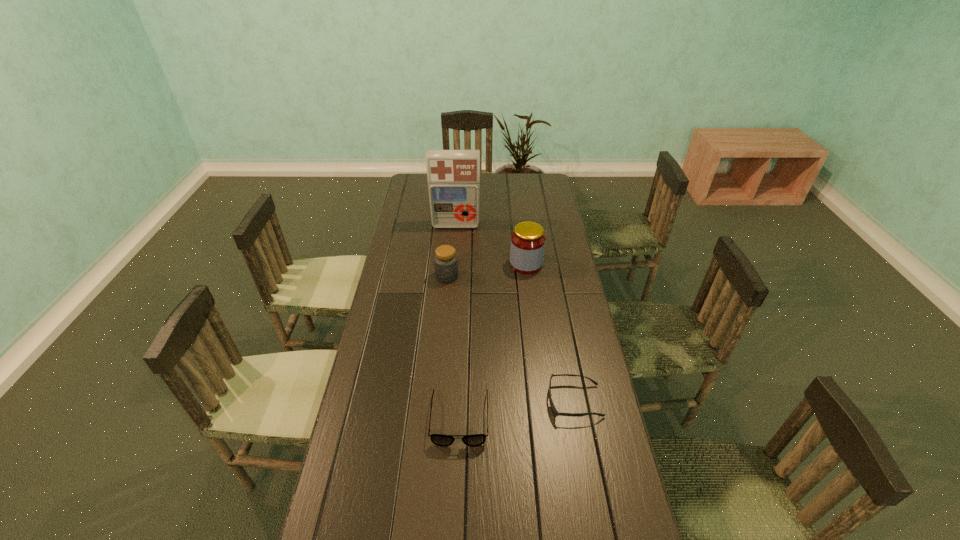
Where is `free space located 0.150m on the surface of the third shortest object near the warning symbol`? The width and height of the screenshot is (960, 540). free space located 0.150m on the surface of the third shortest object near the warning symbol is located at coordinates (444, 310).

At what (x,y) coordinates should I click in order to perform the action: click on free space located 0.170m on the front-facing side of the fourth tallest object. Please return your answer as a coordinate pair (x, y). The image size is (960, 540). Looking at the image, I should click on (456, 511).

This screenshot has width=960, height=540. I want to click on vacant area situated 0.390m on the front-facing side of the shortest object, so click(420, 401).

Identify the location of vacant space situated 0.070m on the front-facing side of the shortest object. (525, 401).

Locate an element on the screen. This screenshot has width=960, height=540. vacant position located 0.350m on the front-facing side of the shortest object is located at coordinates (433, 401).

At what (x,y) coordinates should I click in order to perform the action: click on object positioned at the left edge. Please return your answer as a coordinate pair (x, y). Looking at the image, I should click on (453, 176).

Where is `jar present at the right edge`? The height and width of the screenshot is (540, 960). jar present at the right edge is located at coordinates (527, 247).

Where is `sunglasses located at the right edge`? This screenshot has height=540, width=960. sunglasses located at the right edge is located at coordinates (553, 408).

The height and width of the screenshot is (540, 960). In the image, there is a desktop. Identify the location of vacant space at the left edge. (415, 228).

This screenshot has height=540, width=960. In order to click on vacant region at the right edge in this screenshot , I will do `click(549, 271)`.